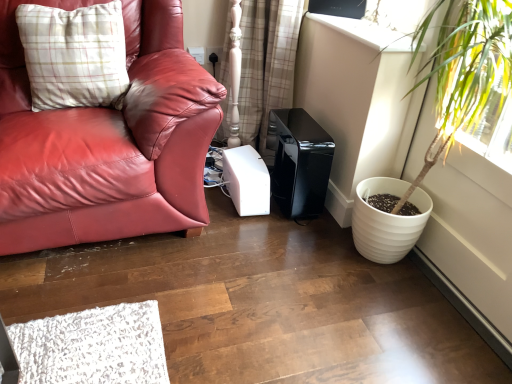
Question: Is transparent plastic window screen at upper center to the right of plaid fabric curtain at center from the viewer's perspective?

Choices:
 (A) no
 (B) yes

Answer: (B)

Question: Can you confirm if transparent plastic window screen at upper center is wider than plaid fabric curtain at center?

Choices:
 (A) no
 (B) yes

Answer: (A)

Question: Is transparent plastic window screen at upper center far away from plaid fabric curtain at center?

Choices:
 (A) yes
 (B) no

Answer: (B)

Question: Is transparent plastic window screen at upper center closer to camera compared to plaid fabric curtain at center?

Choices:
 (A) yes
 (B) no

Answer: (A)

Question: From the image's perspective, is transparent plastic window screen at upper center under plaid fabric curtain at center?

Choices:
 (A) no
 (B) yes

Answer: (A)

Question: Is point (53, 41) closer or farther from the camera than point (367, 215)?

Choices:
 (A) closer
 (B) farther

Answer: (B)

Question: Is plaid fabric pillow at upper left taller or shorter than white textured pot at right?

Choices:
 (A) tall
 (B) short

Answer: (B)

Question: Looking at the image, does plaid fabric pillow at upper left seem bigger or smaller compared to white textured pot at right?

Choices:
 (A) big
 (B) small

Answer: (B)

Question: In the image, is plaid fabric pillow at upper left on the left side or the right side of white textured pot at right?

Choices:
 (A) right
 (B) left

Answer: (B)

Question: From a real-world perspective, is transparent plastic window screen at upper center positioned above or below plaid fabric curtain at center?

Choices:
 (A) above
 (B) below

Answer: (A)

Question: Considering the positions of point (353, 13) and point (248, 19), is point (353, 13) closer or farther from the camera than point (248, 19)?

Choices:
 (A) closer
 (B) farther

Answer: (A)

Question: Considering their positions, is transparent plastic window screen at upper center located in front of or behind plaid fabric curtain at center?

Choices:
 (A) behind
 (B) front

Answer: (B)

Question: Looking at the image, does transparent plastic window screen at upper center seem bigger or smaller compared to plaid fabric curtain at center?

Choices:
 (A) small
 (B) big

Answer: (A)

Question: Relative to transparent plastic window screen at upper center, is plaid fabric pillow at upper left in front or behind?

Choices:
 (A) behind
 (B) front

Answer: (B)

Question: Is point (119, 43) positioned closer to the camera than point (349, 16)?

Choices:
 (A) closer
 (B) farther

Answer: (A)